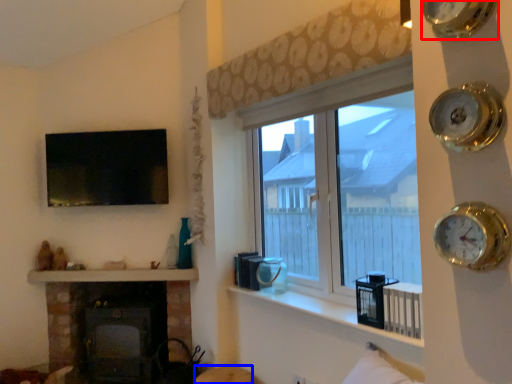
Question: Which object appears farthest to the camera in this image, clock (highlighted by a red box) or furniture (highlighted by a blue box)?

Choices:
 (A) clock
 (B) furniture

Answer: (B)